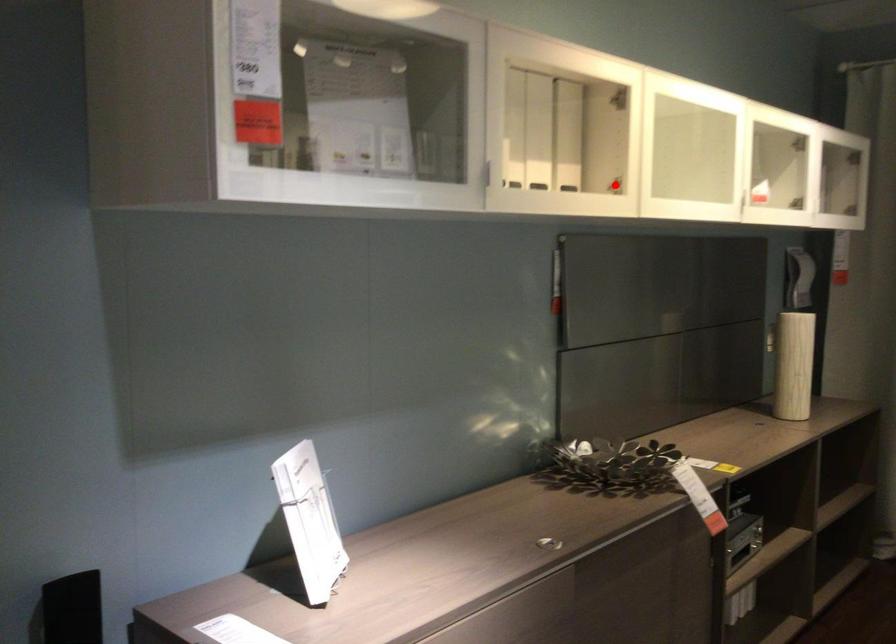
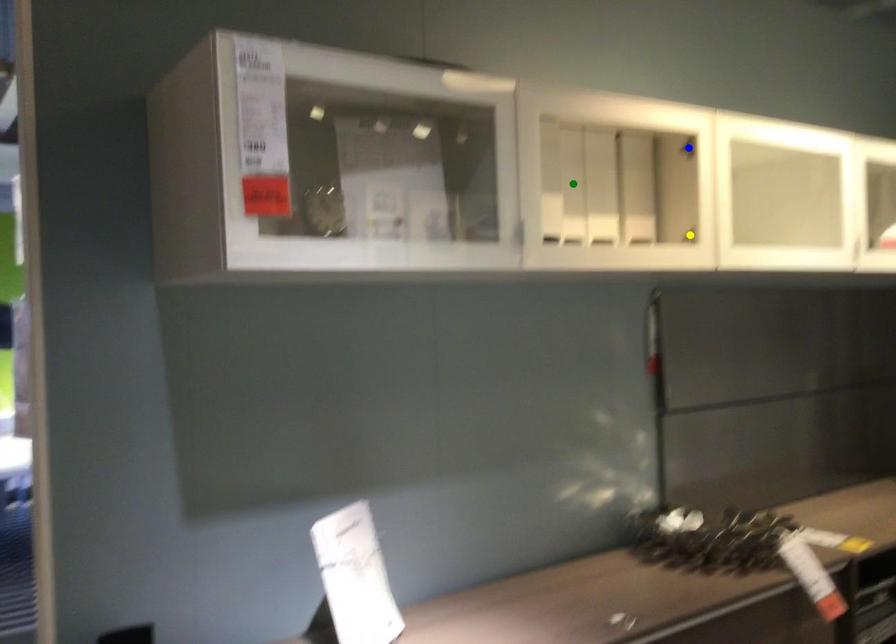
Question: I am providing you with two images of the same scene from different viewpoints. A red point is marked on the first image. You are given multiple points on the second image. Which spot in image 2 lines up with the point in image 1?

Choices:
 (A) blue point
 (B) yellow point
 (C) green point

Answer: (B)